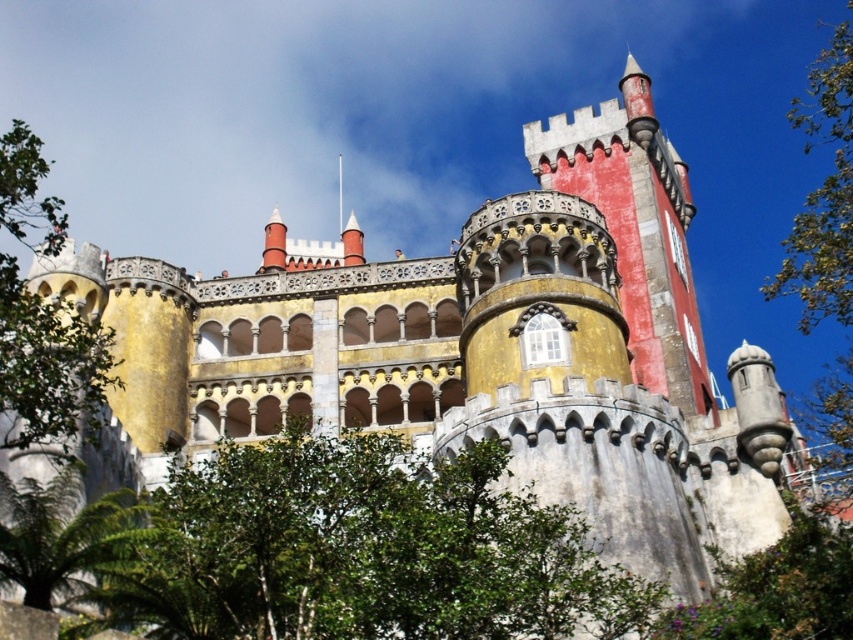
Does green leafy tree at left have a lesser width compared to green leafy tree at lower right?

No, green leafy tree at left is not thinner than green leafy tree at lower right.

Can you confirm if green leafy tree at left is positioned below green leafy tree at lower right?

Actually, green leafy tree at left is above green leafy tree at lower right.

What do you see at coordinates (47, 364) in the screenshot?
I see `green leafy tree at left` at bounding box center [47, 364].

I want to click on green leafy tree at left, so click(x=47, y=364).

Who is shorter, green leafy tree at lower center or green leafy tree at right?

Standing shorter between the two is green leafy tree at lower center.

Who is positioned more to the left, green leafy tree at lower center or green leafy tree at right?

Positioned to the left is green leafy tree at lower center.

Where is `green leafy tree at lower center`? This screenshot has width=853, height=640. green leafy tree at lower center is located at coordinates point(363,550).

The width and height of the screenshot is (853, 640). In order to click on green leafy tree at lower center in this screenshot , I will do `click(363, 550)`.

Does green leafy tree at right have a lesser width compared to green leafy tree at lower right?

No.

Does green leafy tree at right appear over green leafy tree at lower right?

Yes.

Who is more distant from viewer, (801, 116) or (788, 596)?

Point (801, 116)

The height and width of the screenshot is (640, 853). In order to click on green leafy tree at right in this screenshot , I will do `click(825, 253)`.